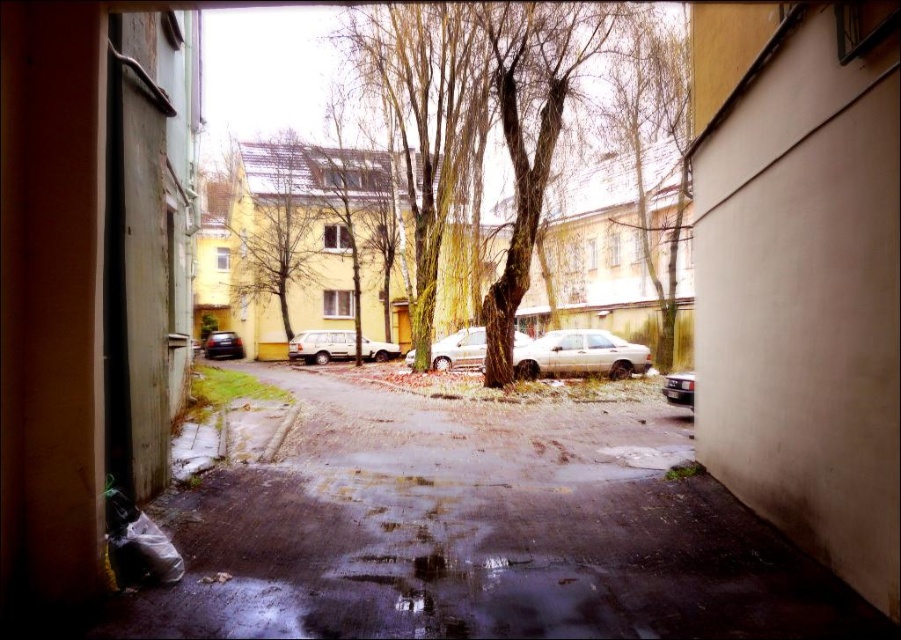
Who is lower down, silver metallic sedan at center or shiny black car at center?

shiny black car at center

How distant is silver metallic sedan at center from shiny black car at center?

silver metallic sedan at center is 20.18 meters away from shiny black car at center.

Is point (460, 364) closer to camera compared to point (203, 348)?

Yes.

Image resolution: width=901 pixels, height=640 pixels. In order to click on silver metallic sedan at center in this screenshot , I will do `click(460, 349)`.

Can you confirm if yellow matte suv at center is taller than shiny black car at center?

No, yellow matte suv at center is not taller than shiny black car at center.

Does yellow matte suv at center come in front of shiny black car at center?

Yes, yellow matte suv at center is in front of shiny black car at center.

Locate an element on the screen. This screenshot has height=640, width=901. yellow matte suv at center is located at coordinates (322, 346).

Describe the element at coordinates (460, 349) in the screenshot. I see `silver metallic sedan at center` at that location.

Which is more to the left, silver metallic sedan at center or shiny silver car at right?

silver metallic sedan at center

Describe the element at coordinates (460, 349) in the screenshot. The width and height of the screenshot is (901, 640). I see `silver metallic sedan at center` at that location.

Where is `silver metallic sedan at center`? The image size is (901, 640). silver metallic sedan at center is located at coordinates (460, 349).